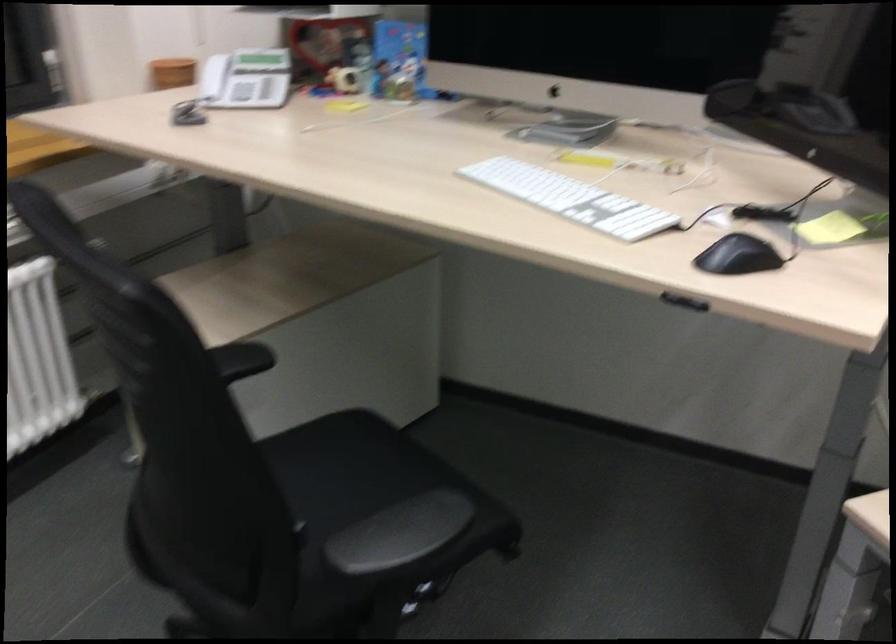
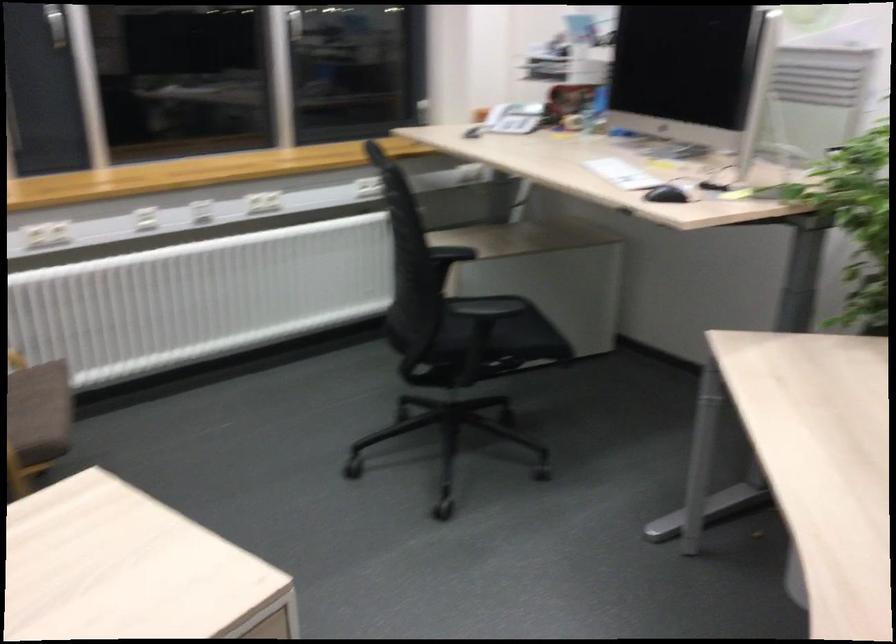
Where in the second image is the point corresponding to pixel 726 258 from the first image?

(666, 194)